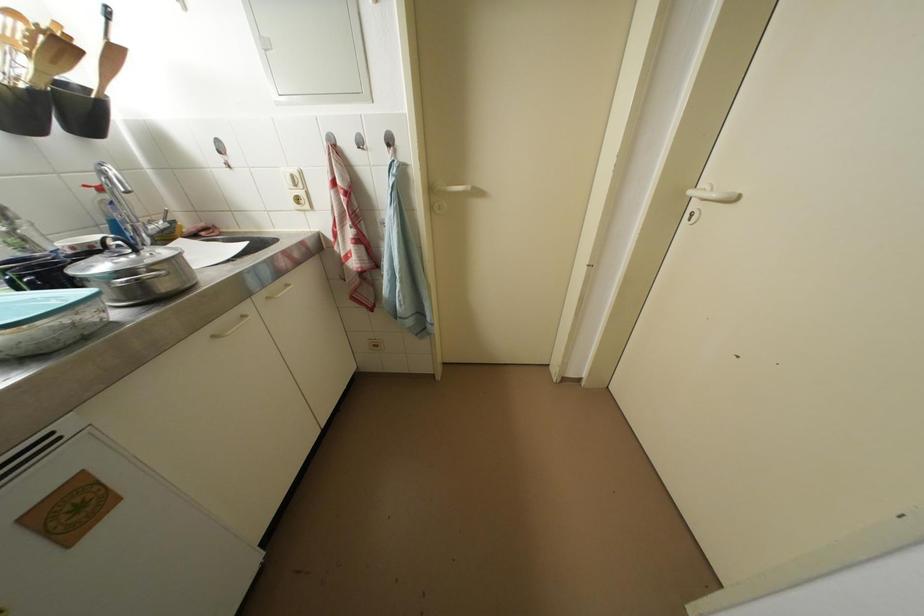
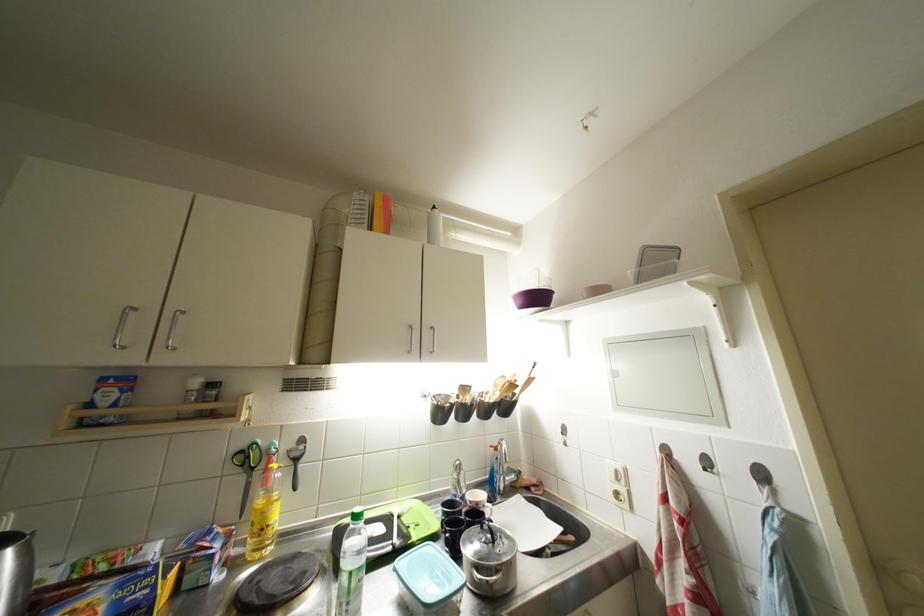
The point at (31, 244) is marked in the first image. Where is the corresponding point in the second image?

(466, 487)